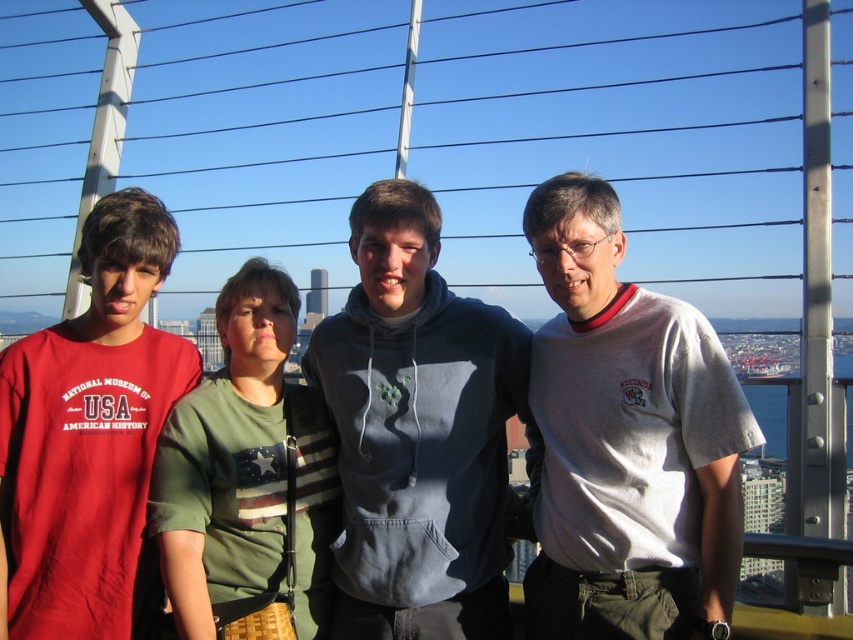
Question: Can you confirm if matte red t-shirt at left is thinner than green fabric shirt at center?

Choices:
 (A) no
 (B) yes

Answer: (A)

Question: Which of the following is the farthest from the observer?

Choices:
 (A) (445, 616)
 (B) (183, 548)

Answer: (A)

Question: Which object is positioned farthest from the green fabric shirt at center?

Choices:
 (A) white cotton t-shirt at center
 (B) matte red t-shirt at left

Answer: (A)

Question: Which object is closer to the camera taking this photo?

Choices:
 (A) matte red t-shirt at left
 (B) gray hoodie at center
 (C) white cotton t-shirt at center

Answer: (C)

Question: Is white cotton t-shirt at center below matte red t-shirt at left?

Choices:
 (A) yes
 (B) no

Answer: (B)

Question: Can you confirm if gray hoodie at center is positioned below matte red t-shirt at left?

Choices:
 (A) yes
 (B) no

Answer: (A)